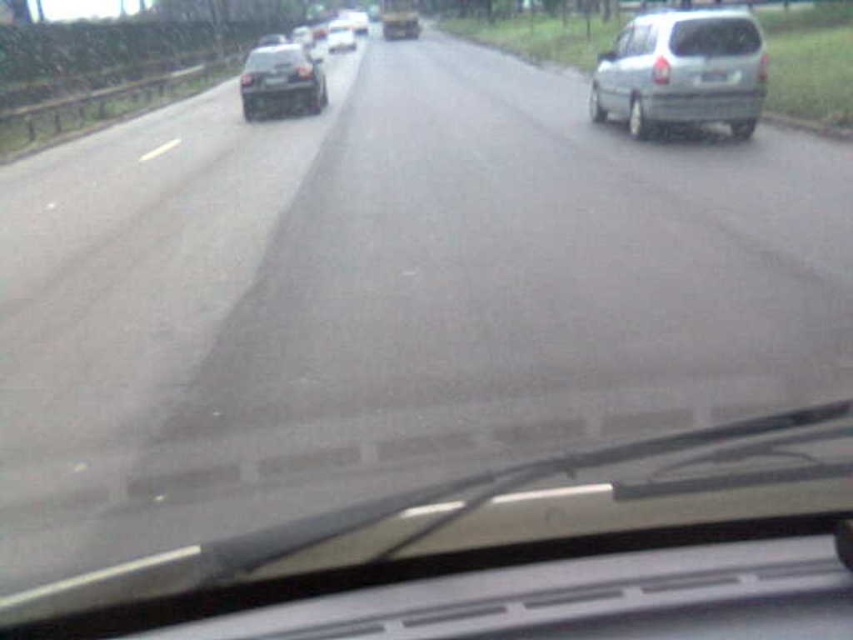
You are a driver looking through the transparent glass windshield at center. Your GPS says you need to turn left at the next intersection. Based on the road layout shown in the image, can you see any vehicles that might block your path when making the left turn?

The transparent glass windshield at center is positioned at point [714,36]. However, the description does not provide information about vehicles blocking the path or the location of the next intersection. Therefore, it is impossible to determine if any vehicles would block the path based on the given information.

You are a driver checking your vehicle. You see the transparent glass windshield at center and the white plastic license plate at right. Which object is wider?

The transparent glass windshield at center is wider than the white plastic license plate at right according to the description.

You are a passenger in the vehicle and want to know how far you are from the point marked at coordinates point (x=693, y=80). Can you determine the distance?

The distance between you and the point marked at coordinates point (x=693, y=80) is 49.17 feet.